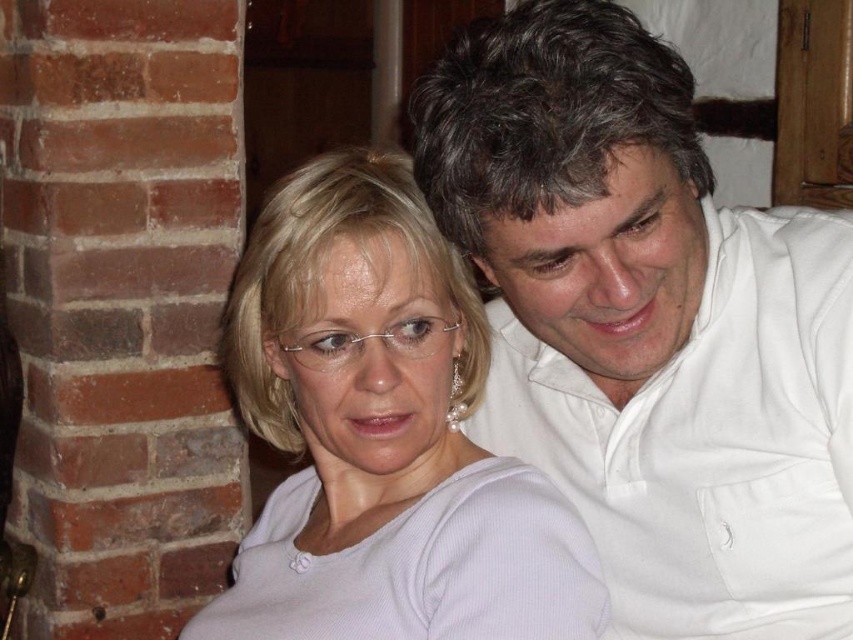
Question: From the image, what is the correct spatial relationship of white smooth shirt at upper right in relation to white matte shirt at center?

Choices:
 (A) right
 (B) left

Answer: (A)

Question: Which point is farther to the camera?

Choices:
 (A) white smooth shirt at upper right
 (B) white matte shirt at center

Answer: (B)

Question: Is white smooth shirt at upper right bigger than white matte shirt at center?

Choices:
 (A) no
 (B) yes

Answer: (A)

Question: Is white smooth shirt at upper right to the left of white matte shirt at center from the viewer's perspective?

Choices:
 (A) no
 (B) yes

Answer: (A)

Question: Which object is closer to the camera taking this photo?

Choices:
 (A) white smooth shirt at upper right
 (B) white matte shirt at center

Answer: (A)